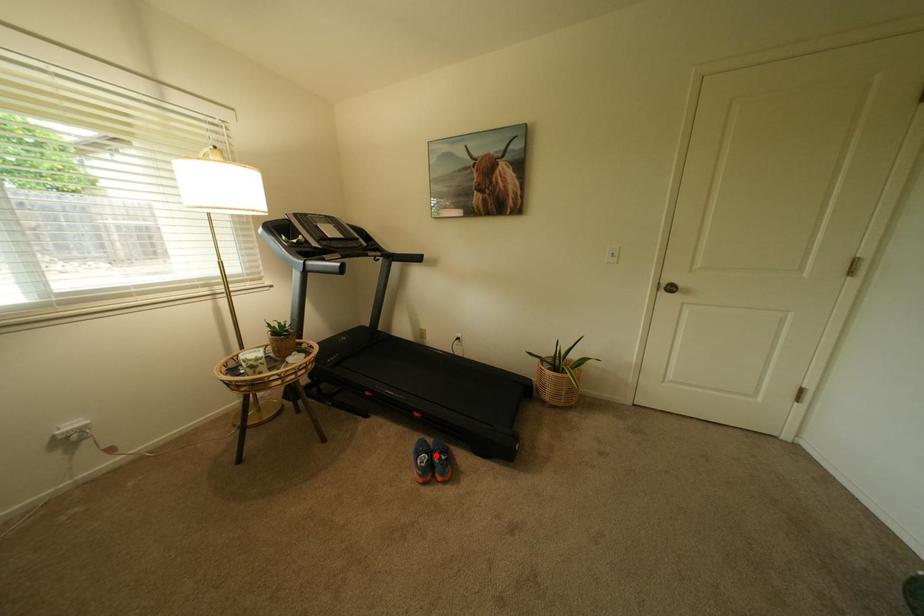
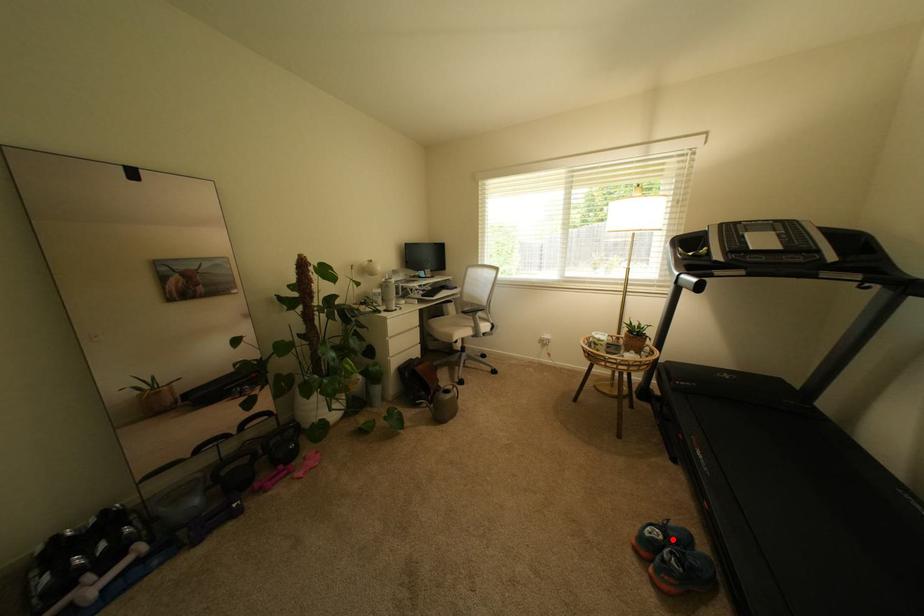
I am providing you with two images of the same scene from different viewpoints. A red point is marked on the first image and another point is marked on the second image. Are the points marked in image1 and image2 representing the same 3D position?

Yes